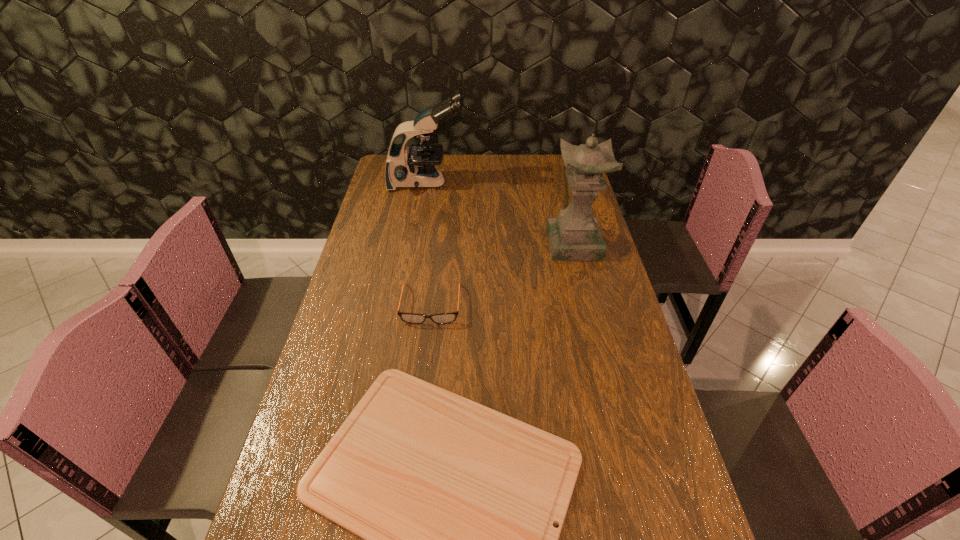
This screenshot has width=960, height=540. Identify the location of the third nearest object. (575, 234).

Image resolution: width=960 pixels, height=540 pixels. Find the location of `the rightmost object`. the rightmost object is located at coordinates (575, 234).

You are a GUI agent. You are given a task and a screenshot of the screen. Output one action in this format:
    pyautogui.click(x=<x>, y=<y>)
    Task: Click on the farthest object
    The image size is (960, 540).
    Given the screenshot: What is the action you would take?
    pyautogui.click(x=415, y=168)

Locate an element on the screen. This screenshot has height=540, width=960. the second shortest object is located at coordinates [x=443, y=318].

Find the location of a particular element. spectacles is located at coordinates (443, 318).

You are a GUI agent. You are given a task and a screenshot of the screen. Output one action in this format:
    pyautogui.click(x=<x>, y=<y>)
    Task: Click on the vacant space located 0.080m at the front opening of the rightmost object
    The width and height of the screenshot is (960, 540).
    Given the screenshot: What is the action you would take?
    pyautogui.click(x=582, y=277)

At what (x,y) coordinates should I click in order to perform the action: click on vacant space located through the eyepieces of the farthest object. Please return your answer as a coordinate pair (x, y). The height and width of the screenshot is (540, 960). Looking at the image, I should click on coord(482,183).

Find the location of a particular element. The height and width of the screenshot is (540, 960). vacant space located 0.400m on the front-facing side of the third tallest object is located at coordinates (413, 465).

What are the coordinates of `object at the far edge` in the screenshot? It's located at (415, 168).

I want to click on object that is at the left edge, so click(415, 168).